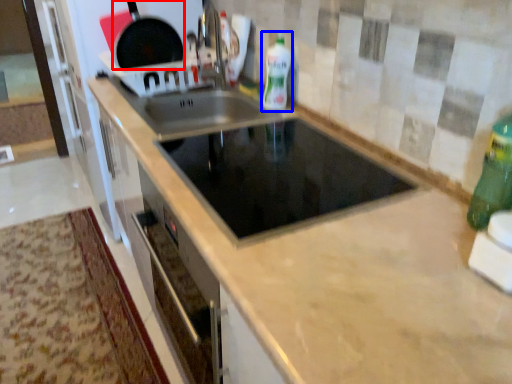
Question: Which object appears farthest to the camera in this image, frying pan (highlighted by a red box) or bottle (highlighted by a blue box)?

Choices:
 (A) frying pan
 (B) bottle

Answer: (A)